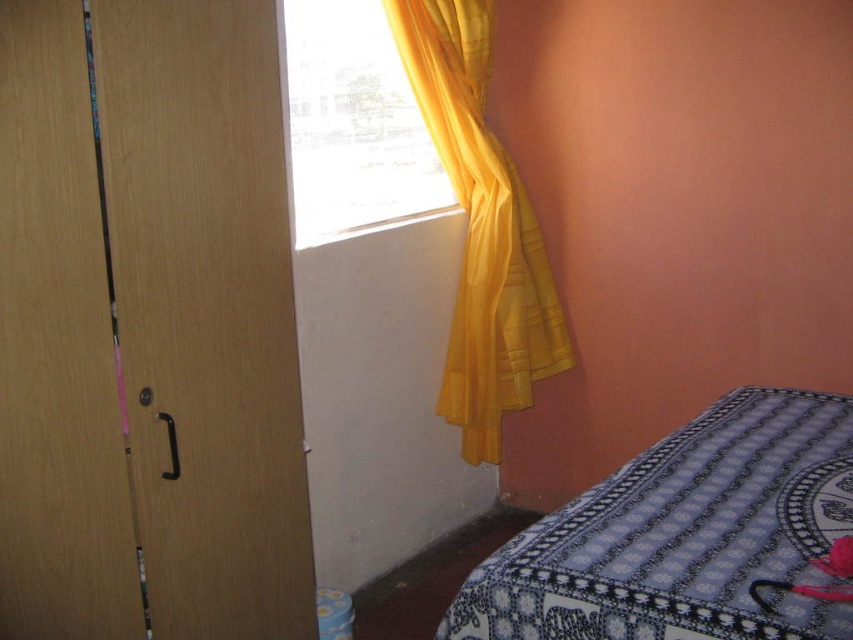
Between yellow sheer curtain at upper left and yellow sheer curtain at upper center, which one appears on the right side from the viewer's perspective?

Positioned to the right is yellow sheer curtain at upper left.

Does yellow sheer curtain at upper left lie behind yellow sheer curtain at upper center?

Yes.

Does point (488, 292) lie behind point (364, 227)?

Yes.

This screenshot has height=640, width=853. I want to click on yellow sheer curtain at upper left, so click(x=480, y=228).

Is wooden closet at left behind yellow sheer curtain at upper center?

No, it is in front of yellow sheer curtain at upper center.

Is wooden closet at left above yellow sheer curtain at upper center?

No, wooden closet at left is not above yellow sheer curtain at upper center.

Describe the element at coordinates (148, 326) in the screenshot. The width and height of the screenshot is (853, 640). I see `wooden closet at left` at that location.

Locate an element on the screen. The height and width of the screenshot is (640, 853). wooden closet at left is located at coordinates (148, 326).

Who is higher up, wooden closet at left or blue printed fabric at lower right?

wooden closet at left is higher up.

Who is more distant from viewer, (55, 451) or (544, 566)?

The point (55, 451) is more distant.

What are the coordinates of `wooden closet at left` in the screenshot? It's located at (148, 326).